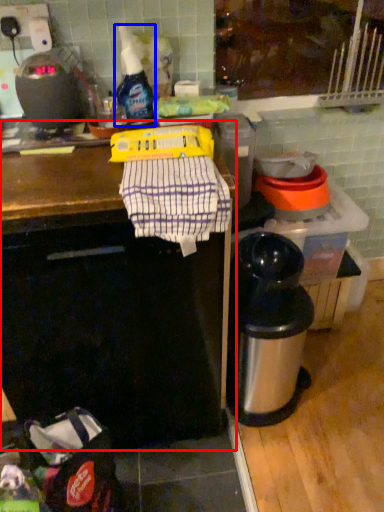
Question: Which point is further to the camera, counter (highlighted by a red box) or bottle (highlighted by a blue box)?

Choices:
 (A) counter
 (B) bottle

Answer: (B)